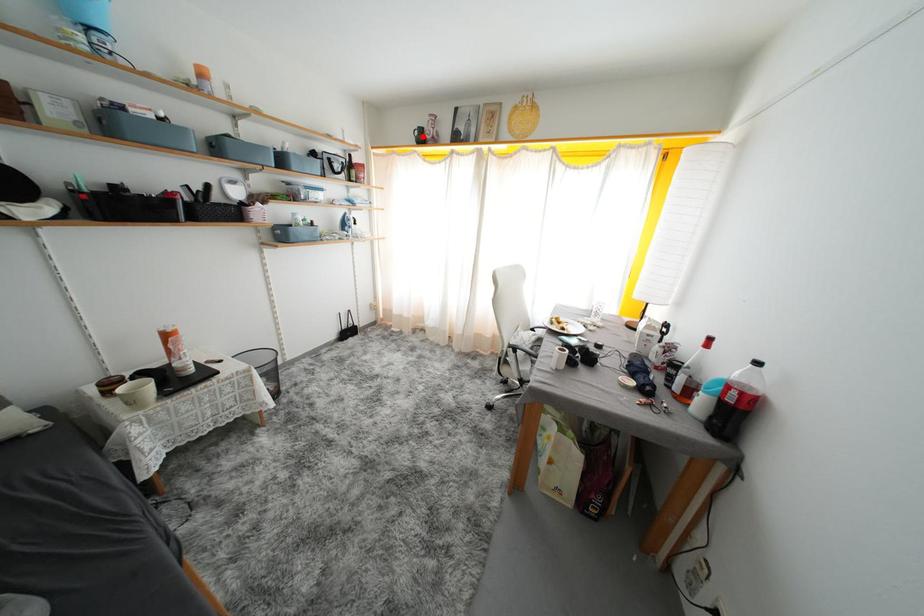
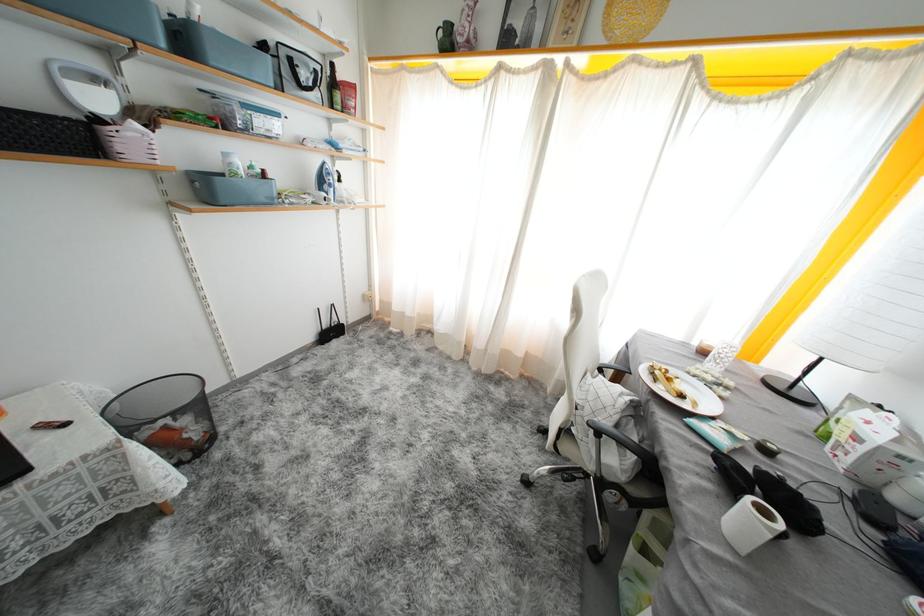
Find the pixel in the second image that matches the highlighted location in the first image.

(446, 37)